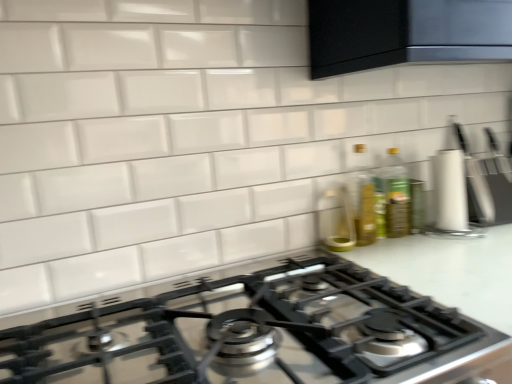
Where is `white glossy countertop at center`? The image size is (512, 384). white glossy countertop at center is located at coordinates (450, 271).

This screenshot has width=512, height=384. What do you see at coordinates (450, 271) in the screenshot?
I see `white glossy countertop at center` at bounding box center [450, 271].

This screenshot has width=512, height=384. In order to click on translucent glass bottle at right, placed as the 2th bottle when sorted from right to left in this screenshot , I will do `click(362, 200)`.

Image resolution: width=512 pixels, height=384 pixels. What do you see at coordinates (336, 220) in the screenshot?
I see `clear glass bottle at center` at bounding box center [336, 220].

Find the location of a particular element. This screenshot has width=512, height=384. green glass bottle at upper right, which ranks as the second bottle in left-to-right order is located at coordinates (395, 195).

The width and height of the screenshot is (512, 384). In order to click on white glossy countertop at center in this screenshot , I will do `click(450, 271)`.

From a real-world perspective, is white glossy countertop at center on white matte knife block at right?

No, from a real-world perspective, white glossy countertop at center is not on top of white matte knife block at right.

From the image's perspective, does white glossy countertop at center appear lower than white matte knife block at right?

Correct, white glossy countertop at center appears lower than white matte knife block at right in the image.

Would you say white glossy countertop at center is inside or outside white matte knife block at right?

white glossy countertop at center is spatially situated outside white matte knife block at right.

How different are the orientations of white glossy countertop at center and white matte knife block at right in degrees?

The angular difference between white glossy countertop at center and white matte knife block at right is 2.78 degrees.

Does white matte knife block at right have a greater height compared to white glossy countertop at center?

No, white matte knife block at right is not taller than white glossy countertop at center.

Is the position of white matte knife block at right less distant than that of white glossy countertop at center?

No, it is behind white glossy countertop at center.

Are white matte knife block at right and white glossy countertop at center making contact?

There is a gap between white matte knife block at right and white glossy countertop at center.

From a real-world perspective, is white matte knife block at right above or below white glossy countertop at center?

Answer: white matte knife block at right is situated higher than white glossy countertop at center in the real world.

Considering the sizes of objects white glossy countertop at center and satin black gas stove at center in the image provided, who is taller, white glossy countertop at center or satin black gas stove at center?

white glossy countertop at center is taller.

From a real-world perspective, which is physically below, white glossy countertop at center or satin black gas stove at center?

white glossy countertop at center is physically lower.

Between white glossy countertop at center and satin black gas stove at center, which one appears on the right side from the viewer's perspective?

From the viewer's perspective, white glossy countertop at center appears more on the right side.

Is white glossy countertop at center far from satin black gas stove at center?

No, white glossy countertop at center is not far away from satin black gas stove at center.

Is green glass bottle at upper right, which ranks as the second bottle in left-to-right order, not inside satin black gas stove at center?

Yes, green glass bottle at upper right, which ranks as the second bottle in left-to-right order, is located beyond the bounds of satin black gas stove at center.

Which is more to the left, green glass bottle at upper right, which ranks as the second bottle in left-to-right order, or satin black gas stove at center?

satin black gas stove at center is more to the left.

Is point (408, 223) in front of point (302, 369)?

That is False.

Considering the sizes of objects green glass bottle at upper right, which ranks as the second bottle in left-to-right order, and satin black gas stove at center in the image provided, who is shorter, green glass bottle at upper right, which ranks as the second bottle in left-to-right order, or satin black gas stove at center?

satin black gas stove at center.

Locate an element on the screen. The height and width of the screenshot is (384, 512). kitchen appliance located on the right of green glass bottle at upper right, which is counted as the 1th bottle, starting from the right is located at coordinates (475, 182).

Is point (478, 176) farther from viewer compared to point (399, 235)?

Yes, it is behind point (399, 235).

Can you confirm if white matte knife block at right is shorter than green glass bottle at upper right, which is counted as the 1th bottle, starting from the right?

Incorrect, the height of white matte knife block at right does not fall short of that of green glass bottle at upper right, which is counted as the 1th bottle, starting from the right.

Between green glass bottle at upper right, which ranks as the second bottle in left-to-right order, and translucent glass bottle at right, placed as the 1th bottle when sorted from left to right, which one is positioned in front?

translucent glass bottle at right, placed as the 1th bottle when sorted from left to right, is more forward.

Can you confirm if green glass bottle at upper right, which ranks as the second bottle in left-to-right order, is bigger than translucent glass bottle at right, placed as the 2th bottle when sorted from right to left?

Yes, green glass bottle at upper right, which ranks as the second bottle in left-to-right order, is bigger than translucent glass bottle at right, placed as the 2th bottle when sorted from right to left.

Could you tell me if green glass bottle at upper right, which ranks as the second bottle in left-to-right order, is facing translucent glass bottle at right, placed as the 2th bottle when sorted from right to left?

No, green glass bottle at upper right, which ranks as the second bottle in left-to-right order, is not aimed at translucent glass bottle at right, placed as the 2th bottle when sorted from right to left.

From a real-world perspective, is green glass bottle at upper right, which is counted as the 1th bottle, starting from the right, physically located above or below translucent glass bottle at right, placed as the 2th bottle when sorted from right to left?

From a real-world perspective, green glass bottle at upper right, which is counted as the 1th bottle, starting from the right, is physically below translucent glass bottle at right, placed as the 2th bottle when sorted from right to left.

Which object is closer to the camera taking this photo, satin black gas stove at center or white glossy countertop at center?

Result: Positioned in front is satin black gas stove at center.

Is satin black gas stove at center shorter than white glossy countertop at center?

Yes.

You are a GUI agent. You are given a task and a screenshot of the screen. Output one action in this format:
    pyautogui.click(x=<x>, y=<y>)
    Task: Click on the counter top below the satin black gas stove at center (from the image's perspective)
    The height and width of the screenshot is (384, 512).
    Given the screenshot: What is the action you would take?
    pyautogui.click(x=450, y=271)

From the image's perspective, which is above, satin black gas stove at center or white glossy countertop at center?

satin black gas stove at center, from the image's perspective.

Locate an element on the screen. The height and width of the screenshot is (384, 512). counter top below the white matte knife block at right (from the image's perspective) is located at coordinates (450, 271).

In the image, there is a white matte knife block at right. Where is `counter top below it (from a real-world perspective)`? This screenshot has width=512, height=384. counter top below it (from a real-world perspective) is located at coordinates (x=450, y=271).

From the image, which object appears to be nearer to white glossy countertop at center, white matte knife block at right or green glass bottle at upper right, which ranks as the second bottle in left-to-right order?

green glass bottle at upper right, which ranks as the second bottle in left-to-right order, lies closer to white glossy countertop at center than the other object.

Looking at the image, which one is located closer to white matte knife block at right, translucent glass bottle at right, placed as the 1th bottle when sorted from left to right, or satin black gas stove at center?

The object closer to white matte knife block at right is translucent glass bottle at right, placed as the 1th bottle when sorted from left to right.

Estimate the real-world distances between objects in this image. Which object is closer to translucent glass bottle at right, placed as the 2th bottle when sorted from right to left, green glass bottle at upper right, which is counted as the 1th bottle, starting from the right, or satin black gas stove at center?

green glass bottle at upper right, which is counted as the 1th bottle, starting from the right.

Looking at the image, which one is located further to satin black gas stove at center, green glass bottle at upper right, which ranks as the second bottle in left-to-right order, or white matte knife block at right?

white matte knife block at right.

Estimate the real-world distances between objects in this image. Which object is closer to white matte knife block at right, green glass bottle at upper right, which ranks as the second bottle in left-to-right order, or translucent glass bottle at right, placed as the 2th bottle when sorted from right to left?

Based on the image, green glass bottle at upper right, which ranks as the second bottle in left-to-right order, appears to be nearer to white matte knife block at right.

Considering their positions, is translucent glass bottle at right, placed as the 2th bottle when sorted from right to left, positioned closer to satin black gas stove at center than clear glass bottle at center?

clear glass bottle at center lies closer to satin black gas stove at center than the other object.

From the image, which object appears to be nearer to translucent glass bottle at right, placed as the 1th bottle when sorted from left to right, white matte knife block at right or clear glass bottle at center?

clear glass bottle at center is positioned closer to the anchor translucent glass bottle at right, placed as the 1th bottle when sorted from left to right.

Looking at the image, which one is located closer to translucent glass bottle at right, placed as the 2th bottle when sorted from right to left, clear glass bottle at center or green glass bottle at upper right, which ranks as the second bottle in left-to-right order?

The object closer to translucent glass bottle at right, placed as the 2th bottle when sorted from right to left, is clear glass bottle at center.

At what (x,y) coordinates should I click in order to perform the action: click on appliance positioned between satin black gas stove at center and translucent glass bottle at right, placed as the 1th bottle when sorted from left to right, from near to far. Please return your answer as a coordinate pair (x, y). This screenshot has width=512, height=384. Looking at the image, I should click on (336, 220).

The width and height of the screenshot is (512, 384). What are the coordinates of `counter top located between satin black gas stove at center and white matte knife block at right in the left-right direction` in the screenshot? It's located at (450, 271).

Where is `bottle between green glass bottle at upper right, which ranks as the second bottle in left-to-right order, and white glossy countertop at center in the up-down direction`? This screenshot has height=384, width=512. bottle between green glass bottle at upper right, which ranks as the second bottle in left-to-right order, and white glossy countertop at center in the up-down direction is located at coordinates tap(362, 200).

The height and width of the screenshot is (384, 512). I want to click on bottle between satin black gas stove at center and white matte knife block at right along the z-axis, so click(x=362, y=200).